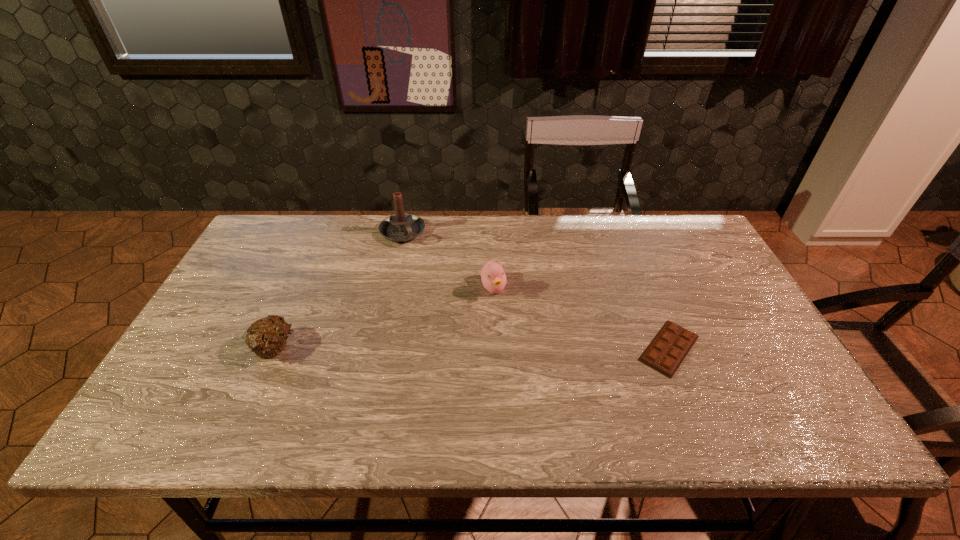
Locate an element on the screen. The image size is (960, 540). free spot that satisfies the following two spatial constraints: 1. on the back side of the muffin; 2. on the right side of the second tallest object is located at coordinates (300, 288).